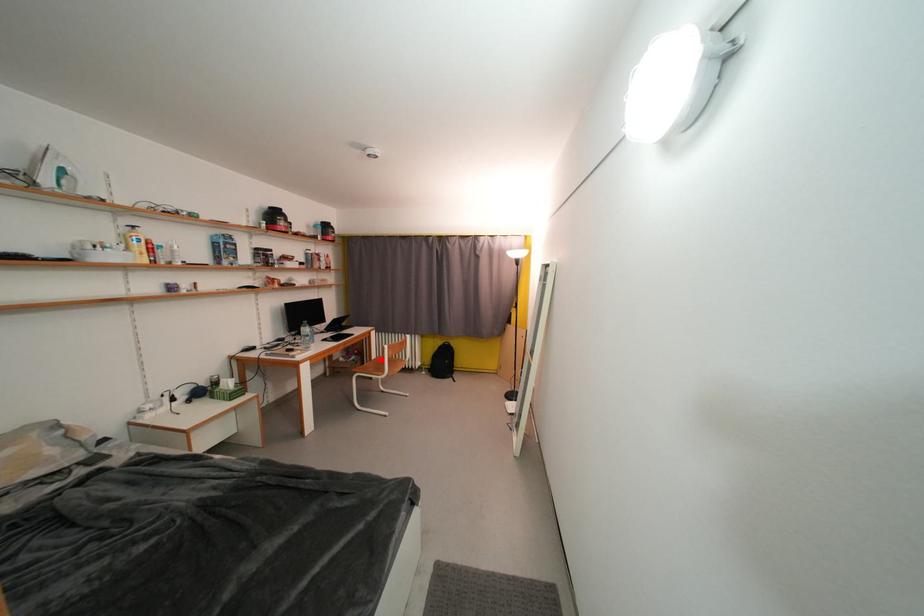
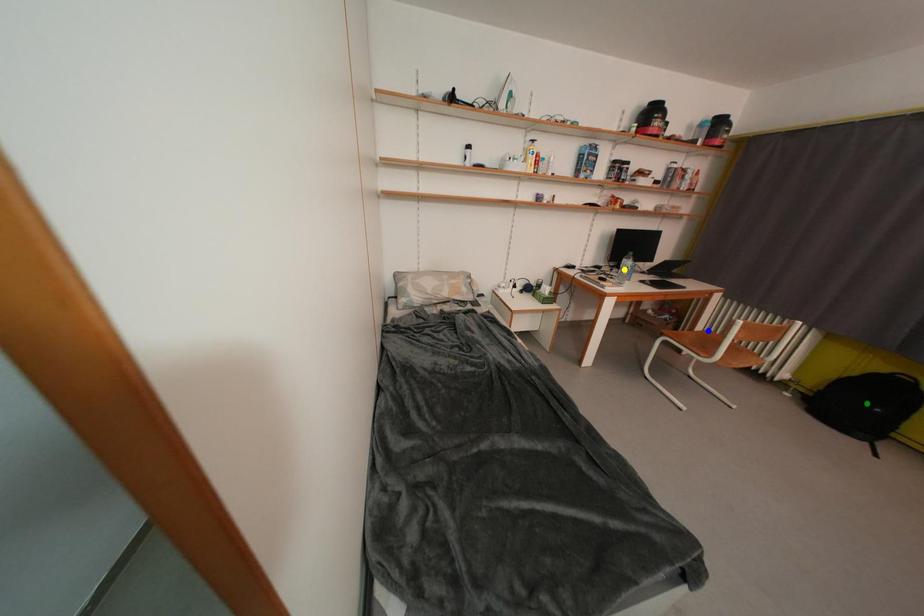
Question: I am providing you with two images of the same scene from different viewpoints. A red point is marked on the first image. You are given multiple points on the second image. Can you choose the point in image 2 that corresponds to the point in image 1?

Choices:
 (A) blue point
 (B) green point
 (C) yellow point

Answer: (A)